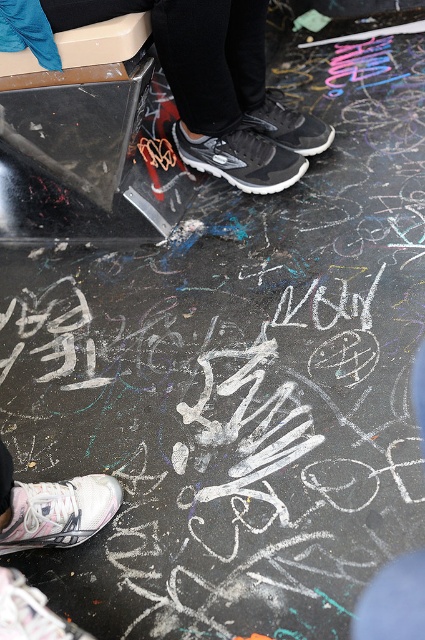
Question: Can you confirm if white mesh shoe at lower left is wider than matte black sneaker at center?

Choices:
 (A) yes
 (B) no

Answer: (B)

Question: Is white mesh sneaker at lower left to the left of matte black sneaker at center from the viewer's perspective?

Choices:
 (A) no
 (B) yes

Answer: (B)

Question: Which object is the farthest from the black mesh running shoe at center?

Choices:
 (A) white mesh sneaker at lower left
 (B) matte black sneaker at center
 (C) white mesh shoe at lower left

Answer: (A)

Question: Which point is farther to the camera?

Choices:
 (A) matte black sneaker at center
 (B) white mesh sneaker at lower left
 (C) black mesh running shoe at center

Answer: (A)

Question: Which point appears closest to the camera in this image?

Choices:
 (A) (283, 177)
 (B) (53, 497)

Answer: (B)

Question: Does black mesh running shoe at center appear on the left side of white mesh sneaker at lower left?

Choices:
 (A) no
 (B) yes

Answer: (A)